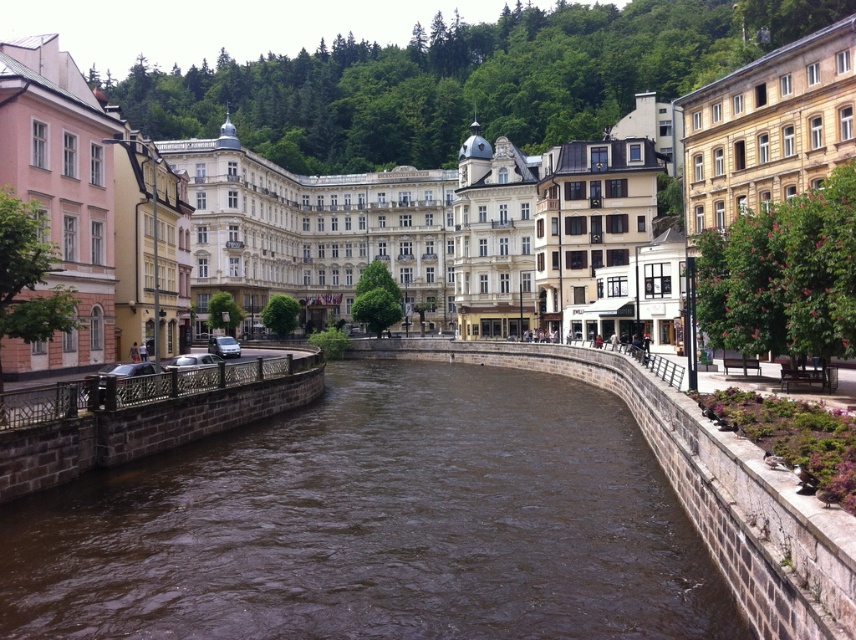
You are a drone operator tasked with capturing aerial footage of the urban scene. Your drone is currently at the point marked as point (x=593, y=499). You need to fly it to a point that is exactly halfway between your current position and the opposite bank of the river. What are the coordinates of this midpoint?

The coordinates of the midpoint between point (x=593, y=499) and the opposite bank of the river would be halfway along the path towards the bank. However, without specific coordinate data for the opposite bank, an exact calculation isn

You are standing on the embankment next to the brown stone river at center and want to take a photo of the brown stone buildings at center. Since the river is in the way, can you still capture the buildings in your shot without moving your camera position?

The brown stone river at center is closer to the viewer than the brown stone buildings at center, so the river will block the view of the buildings. You cannot capture the buildings in your shot without moving your camera position.

You are standing at the point labeled as point (376, 524) in the image. What is the closest object to you in the scene?

The point labeled as point (376, 524) corresponds to the brown stone river at center, so the closest object to you is the brown stone river at center.